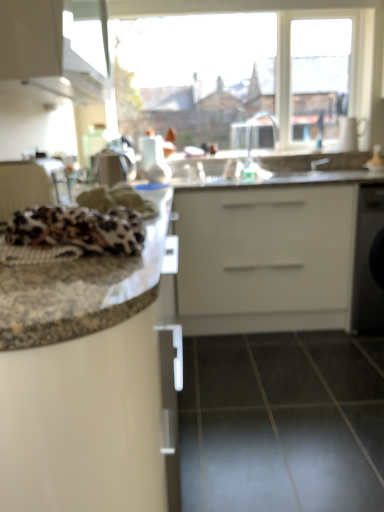
This screenshot has height=512, width=384. Describe the element at coordinates (234, 7) in the screenshot. I see `transparent glass window at upper center` at that location.

This screenshot has height=512, width=384. Identify the location of granite countertop at center. (208, 265).

The width and height of the screenshot is (384, 512). What do you see at coordinates (251, 129) in the screenshot?
I see `silver metallic faucet at upper center` at bounding box center [251, 129].

The width and height of the screenshot is (384, 512). Find the location of `black glossy tile at lower center`. black glossy tile at lower center is located at coordinates (282, 423).

Is white glossy cabinet at upper left spatially inside transparent glass window at upper center, or outside of it?

white glossy cabinet at upper left cannot be found inside transparent glass window at upper center.

From the image's perspective, would you say white glossy cabinet at upper left is shown under transparent glass window at upper center?

Yes, from the image's perspective, white glossy cabinet at upper left is beneath transparent glass window at upper center.

Which is less distant, (75, 81) or (323, 17)?

Point (75, 81) appears to be closer to the viewer than point (323, 17).

Considering the relative sizes of black glossy tile at lower center and granite countertop at center in the image provided, is black glossy tile at lower center thinner than granite countertop at center?

Incorrect, the width of black glossy tile at lower center is not less than that of granite countertop at center.

From the image's perspective, which is below, black glossy tile at lower center or granite countertop at center?

From the image's view, black glossy tile at lower center is below.

Does point (348, 337) lie behind point (141, 309)?

Yes, point (348, 337) is farther from viewer.

Is black glossy tile at lower center situated inside granite countertop at center or outside?

black glossy tile at lower center lies outside granite countertop at center.

Find the location of a particular element. This screenshot has width=384, height=512. counter top below the transparent glass window at upper center (from a real-world perspective) is located at coordinates 208,265.

Can you tell me how much granite countertop at center and transparent glass window at upper center differ in facing direction?

There is a 0.252-degree angle between the facing directions of granite countertop at center and transparent glass window at upper center.

Considering the sizes of objects granite countertop at center and transparent glass window at upper center in the image provided, who is thinner, granite countertop at center or transparent glass window at upper center?

transparent glass window at upper center.

The width and height of the screenshot is (384, 512). I want to click on material that appears above the granite countertop at center (from a real-world perspective), so click(78, 229).

Considering the positions of point (84, 220) and point (26, 286), is point (84, 220) closer or farther from the camera than point (26, 286)?

Point (84, 220) is positioned farther from the camera compared to point (26, 286).

From the image's perspective, relative to granite countertop at center, is leopard print fabric at left above or below?

Clearly, from the image's perspective, leopard print fabric at left is below granite countertop at center.

How different are the orientations of leopard print fabric at left and granite countertop at center in degrees?

89.7 degrees.

Can you tell me how much granite countertop at center and leopard print fabric at left differ in facing direction?

granite countertop at center and leopard print fabric at left are facing 89.7 degrees away from each other.

Is granite countertop at center positioned in front of leopard print fabric at left?

No, the depth of granite countertop at center is greater than that of leopard print fabric at left.

Considering the sizes of granite countertop at center and leopard print fabric at left in the image, is granite countertop at center wider or thinner than leopard print fabric at left?

In the image, granite countertop at center appears to be wider than leopard print fabric at left.

In the image, is transparent glass window at upper center positioned in front of or behind granite countertop at left?

transparent glass window at upper center is behind granite countertop at left.

Which is more to the right, transparent glass window at upper center or granite countertop at left?

From the viewer's perspective, transparent glass window at upper center appears more on the right side.

Considering the sizes of objects transparent glass window at upper center and granite countertop at left in the image provided, who is shorter, transparent glass window at upper center or granite countertop at left?

transparent glass window at upper center.

Considering the points (310, 483) and (103, 310), which point is behind, point (310, 483) or point (103, 310)?

The point (310, 483) is farther from the camera.

Can you confirm if black glossy tile at lower center is smaller than granite countertop at left?

Correct, black glossy tile at lower center occupies less space than granite countertop at left.

Is granite countertop at left at the back of black glossy tile at lower center?

black glossy tile at lower center does not have its back to granite countertop at left.

Find the location of `counter on the left of black glossy tile at lower center`. counter on the left of black glossy tile at lower center is located at coordinates (83, 380).

Find the location of a particular element. Image resolution: width=384 pixels, height=512 pixels. window below the white glossy cabinet at upper left (from a real-world perspective) is located at coordinates (234, 7).

The height and width of the screenshot is (512, 384). What are the coordinates of `tile lying below the granite countertop at center (from the image's perspective)` in the screenshot? It's located at (282, 423).

From the image, which object appears to be farther from white glossy cabinet at upper left, silver metallic faucet at upper center or leopard print fabric at left?

silver metallic faucet at upper center is further to white glossy cabinet at upper left.

Based on their spatial positions, is white glossy cabinet at upper left or leopard print fabric at left closer to granite countertop at center?

white glossy cabinet at upper left.

Looking at the image, which one is located closer to granite countertop at center, transparent glass window at upper center or black glossy tile at lower center?

black glossy tile at lower center lies closer to granite countertop at center than the other object.

From the image, which object appears to be farther from transparent glass window at upper center, white glossy cabinet at upper left or granite countertop at center?

granite countertop at center is further to transparent glass window at upper center.

Looking at the image, which one is located further to granite countertop at left, granite countertop at center or leopard print fabric at left?

granite countertop at center is positioned further to the anchor granite countertop at left.

When comparing their distances from white glossy cabinet at upper left, does leopard print fabric at left or black glossy tile at lower center seem closer?

leopard print fabric at left.

Estimate the real-world distances between objects in this image. Which object is further from transparent glass window at upper center, black glossy tile at lower center or white glossy cabinet at upper left?

black glossy tile at lower center is positioned further to the anchor transparent glass window at upper center.

Estimate the real-world distances between objects in this image. Which object is further from granite countertop at center, white glossy cabinet at upper left or silver metallic faucet at upper center?

Among the two, white glossy cabinet at upper left is located further to granite countertop at center.

Identify the location of tile between leopard print fabric at left and granite countertop at center from front to back. (282, 423).

At what (x,y) coordinates should I click in order to perform the action: click on material positioned between granite countertop at left and transparent glass window at upper center from near to far. Please return your answer as a coordinate pair (x, y). Image resolution: width=384 pixels, height=512 pixels. Looking at the image, I should click on (78, 229).

Where is `material between granite countertop at left and black glossy tile at lower center in the horizontal direction`? The image size is (384, 512). material between granite countertop at left and black glossy tile at lower center in the horizontal direction is located at coordinates (78, 229).

Find the location of a particular element. counter top positioned between granite countertop at left and silver metallic faucet at upper center from near to far is located at coordinates (208, 265).